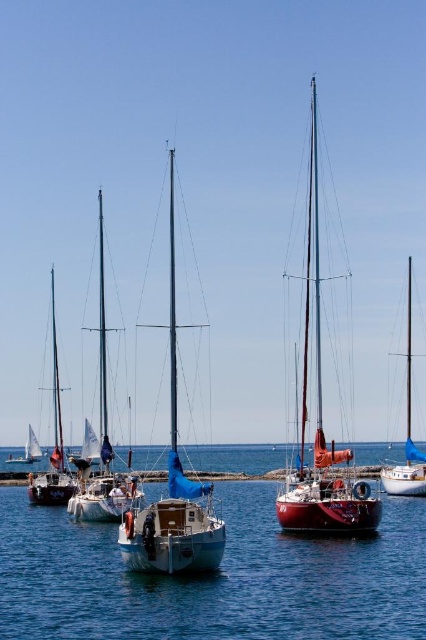
Is point (380, 573) positioned after point (175, 538)?

Yes, it is behind point (175, 538).

Is clear blue water at center closer to camera compared to white matte sailboat at center?

Yes, clear blue water at center is in front of white matte sailboat at center.

Is point (232, 486) positioned after point (172, 332)?

Yes, it is behind point (172, 332).

Where is `clear blue water at center`? clear blue water at center is located at coordinates (213, 579).

Is white matte sailboat at center above matte blue sailboat at center?

Yes, white matte sailboat at center is above matte blue sailboat at center.

Which is in front, point (152, 529) or point (408, 312)?

Point (152, 529) is more forward.

At what (x,y) coordinates should I click in order to perform the action: click on white matte sailboat at center. Please return your answer as a coordinate pair (x, y). Looking at the image, I should click on (172, 492).

Is white matte sailboat at left above matte blue sailboat at center?

Actually, white matte sailboat at left is below matte blue sailboat at center.

Can you confirm if white matte sailboat at left is bigger than matte blue sailboat at center?

Yes.

Does point (68, 493) lie in front of point (406, 333)?

Yes, point (68, 493) is closer to viewer.

Locate an element on the screen. The width and height of the screenshot is (426, 640). white matte sailboat at left is located at coordinates (54, 442).